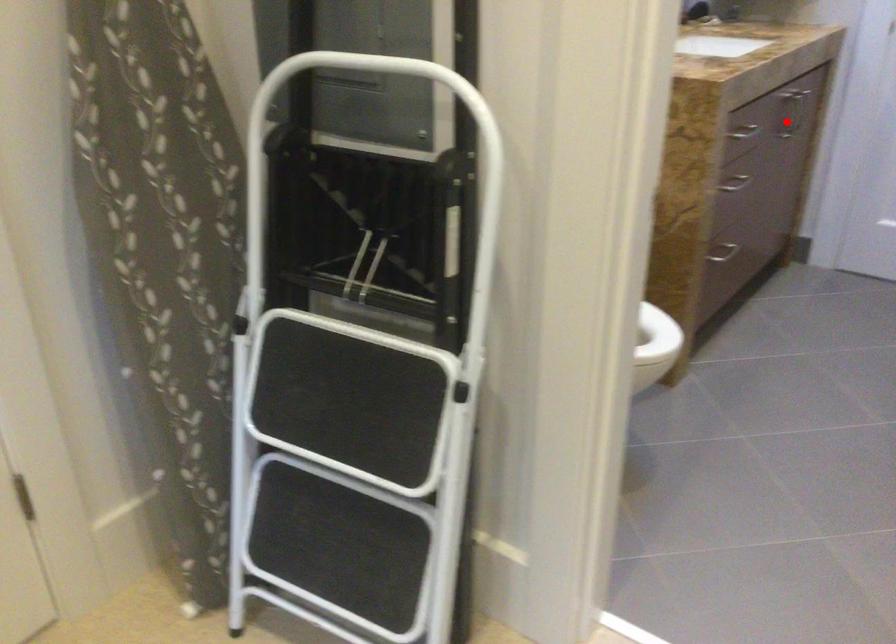
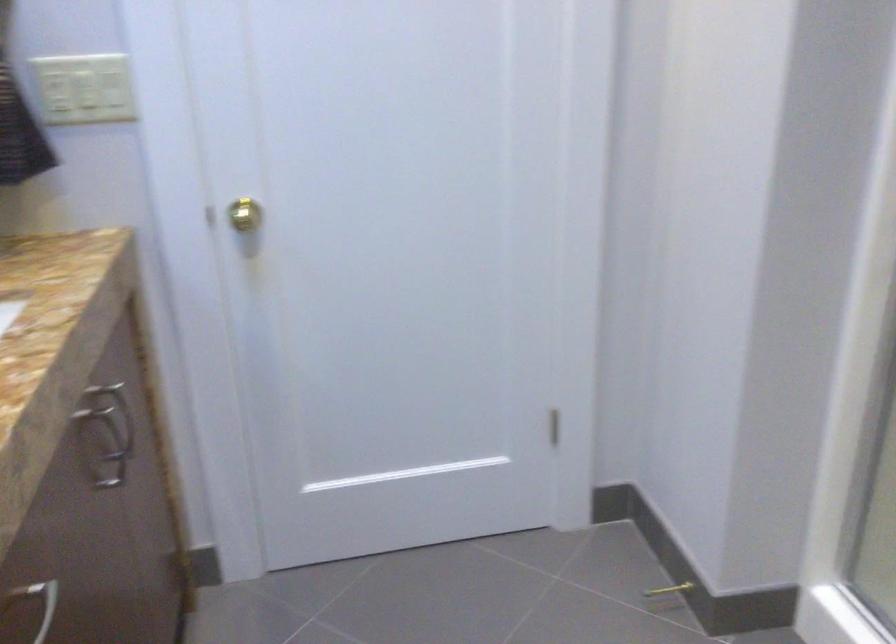
The point at the highlighted location is marked in the first image. Where is the corresponding point in the second image?

(113, 453)